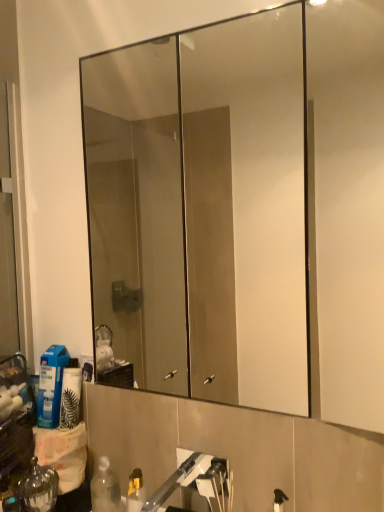
This screenshot has height=512, width=384. I want to click on blank space situated above clear glass mirror at upper center (from a real-world perspective), so click(x=189, y=23).